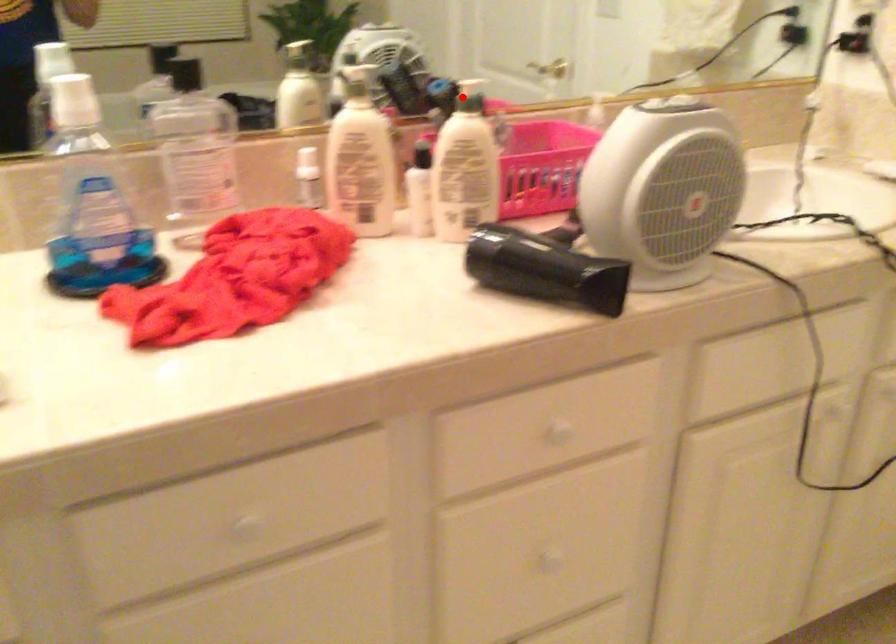
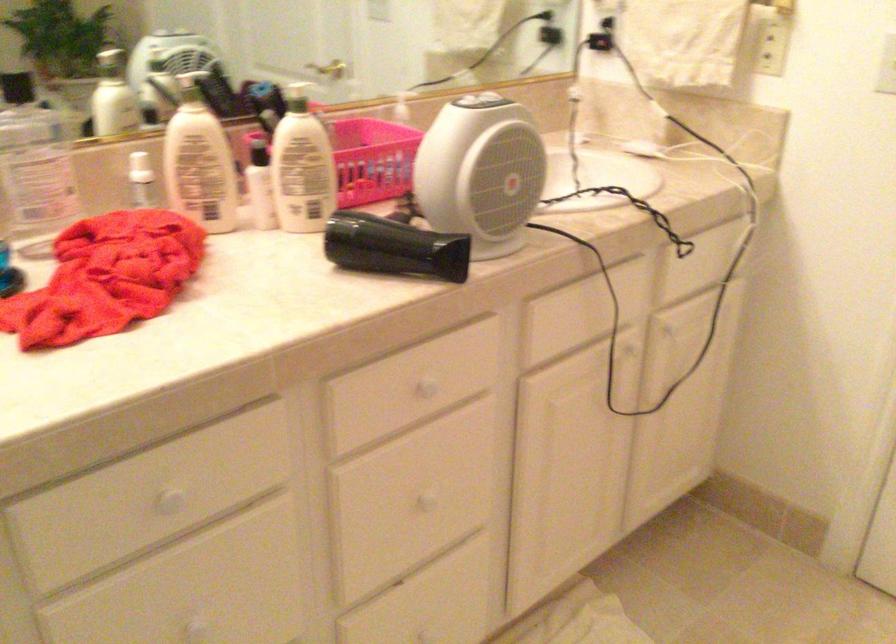
Find the pixel in the second image that matches the highlighted location in the first image.

(297, 100)